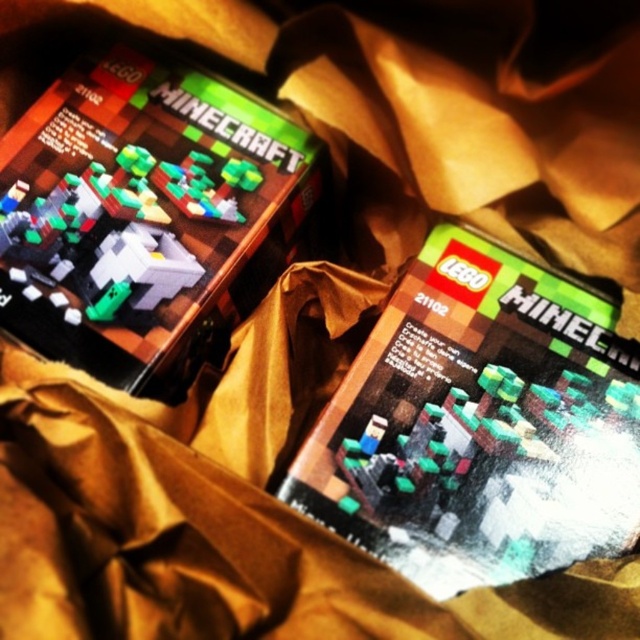
Question: Considering the relative positions of matte cardboard lego minecraft set at upper left and matte plastic lego minecraft set at center in the image provided, where is matte cardboard lego minecraft set at upper left located with respect to matte plastic lego minecraft set at center?

Choices:
 (A) below
 (B) above

Answer: (B)

Question: Is matte black lego minecraft set at center wider than matte plastic lego minecraft set at center?

Choices:
 (A) no
 (B) yes

Answer: (B)

Question: Which of the following is the farthest from the observer?

Choices:
 (A) (244, 275)
 (B) (346, 452)

Answer: (A)

Question: Does matte cardboard lego minecraft set at upper left have a larger size compared to matte plastic lego minecraft set at center?

Choices:
 (A) no
 (B) yes

Answer: (B)

Question: Which object appears farthest from the camera in this image?

Choices:
 (A) matte plastic lego minecraft set at center
 (B) matte cardboard lego minecraft set at upper left

Answer: (B)

Question: Which object appears closest to the camera in this image?

Choices:
 (A) matte black lego minecraft set at center
 (B) matte cardboard lego minecraft set at upper left

Answer: (A)